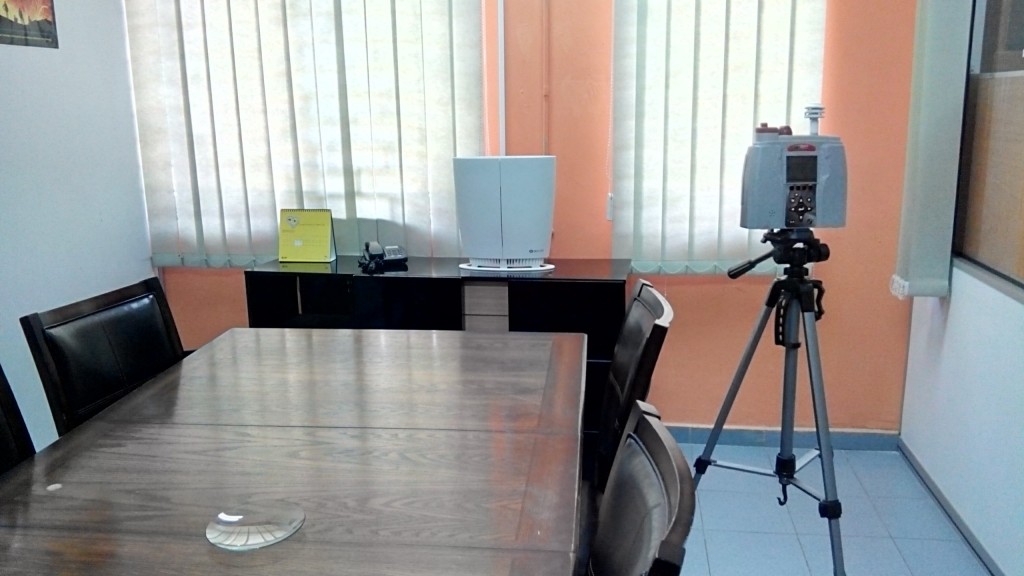
I want to click on dark brown credenza, so click(424, 276).